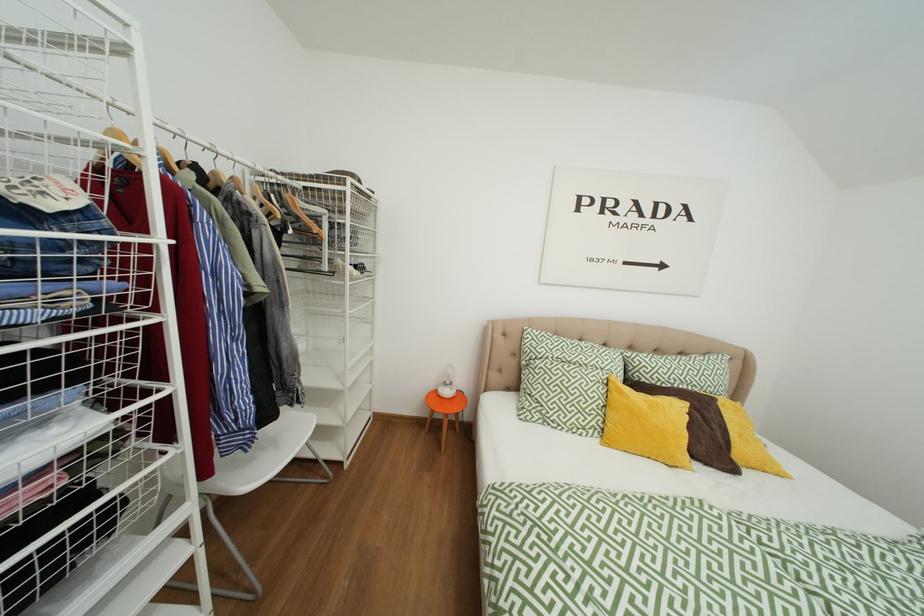
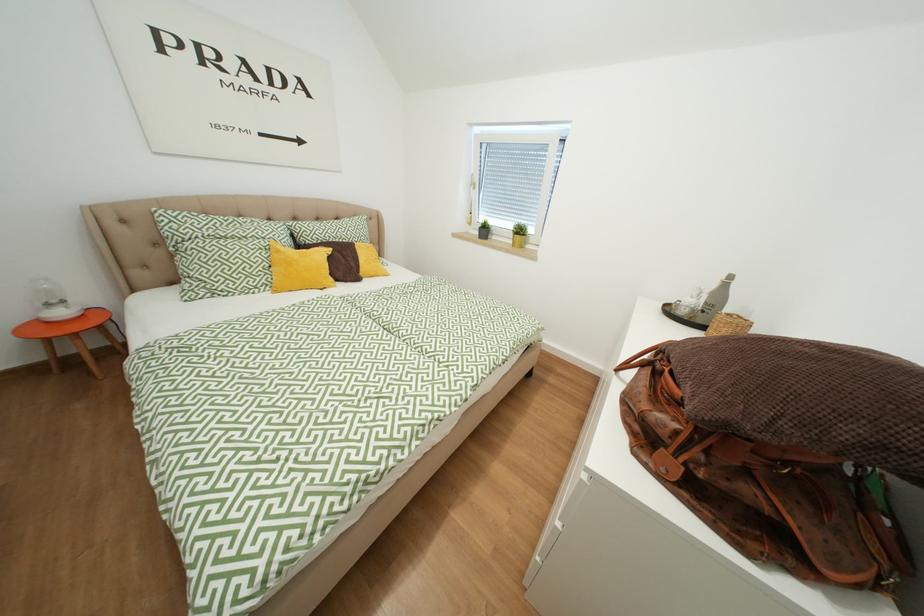
The first image is from the beginning of the video and the second image is from the end. How did the camera likely rotate when shooting the video?

The camera rotated toward right-down.